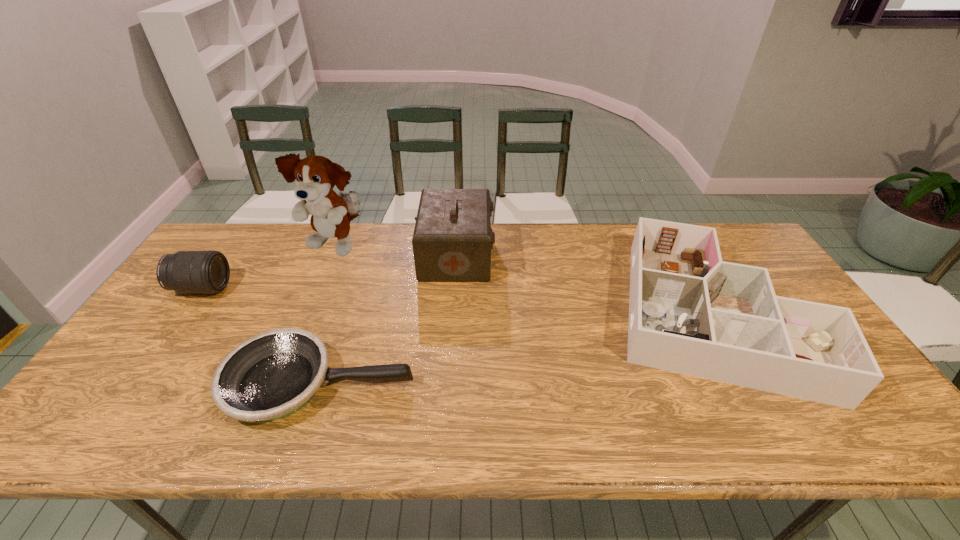
You are a GUI agent. You are given a task and a screenshot of the screen. Output one action in this format:
    pyautogui.click(x=<x>, y=<y>)
    Task: Click on the puppy
    This screenshot has height=540, width=960.
    Given the screenshot: What is the action you would take?
    pyautogui.click(x=316, y=176)

Identify the location of the second tallest object. (452, 240).

Where is `telephoto lens`? The width and height of the screenshot is (960, 540). telephoto lens is located at coordinates (187, 272).

In order to click on the rightmost object in this screenshot , I will do `click(691, 313)`.

I want to click on frying pan, so click(x=269, y=376).

I want to click on vacant space located on the face of the tallest object, so click(x=303, y=327).

Where is `vacant space located on the right of the first-aid kit`? vacant space located on the right of the first-aid kit is located at coordinates (583, 255).

Where is `vacant space located 0.310m on the surface of the telephoto lens`? vacant space located 0.310m on the surface of the telephoto lens is located at coordinates (332, 288).

At what (x,y) coordinates should I click in order to perform the action: click on vacant area situated on the front of the dollhouse. Please return your answer as a coordinate pair (x, y). Image resolution: width=960 pixels, height=540 pixels. Looking at the image, I should click on (779, 443).

Locate an element on the screen. The height and width of the screenshot is (540, 960). vacant space located on the handle side of the frying pan is located at coordinates (489, 384).